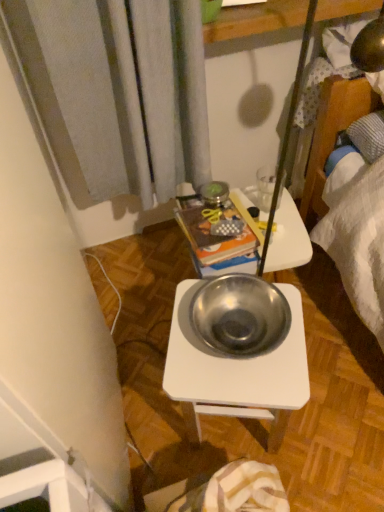
The width and height of the screenshot is (384, 512). I want to click on free space on the front side of metallic silver bowl at center, so (246, 388).